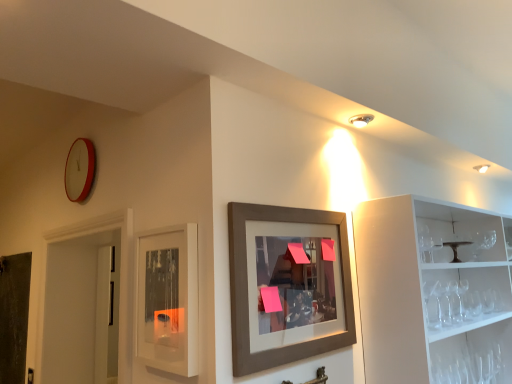
Question: Considering the positions of brown wooden picture frame at center and metallic dark brown cake stand at right in the image, is brown wooden picture frame at center wider or thinner than metallic dark brown cake stand at right?

Choices:
 (A) thin
 (B) wide

Answer: (A)

Question: In the image, is brown wooden picture frame at center positioned in front of or behind metallic dark brown cake stand at right?

Choices:
 (A) front
 (B) behind

Answer: (A)

Question: Estimate the real-world distances between objects in this image. Which object is closer to the metallic silver faucet at lower center?

Choices:
 (A) metallic dark brown cake stand at right
 (B) dark gray matte door at left
 (C) matte red clock at upper left
 (D) brown wooden picture frame at center
 (E) matte glass cabinet at center

Answer: (D)

Question: Based on their relative distances, which object is nearer to the dark gray matte door at left?

Choices:
 (A) matte glass cabinet at center
 (B) metallic silver faucet at lower center
 (C) matte red clock at upper left
 (D) metallic dark brown cake stand at right
 (E) brown wooden picture frame at center

Answer: (C)